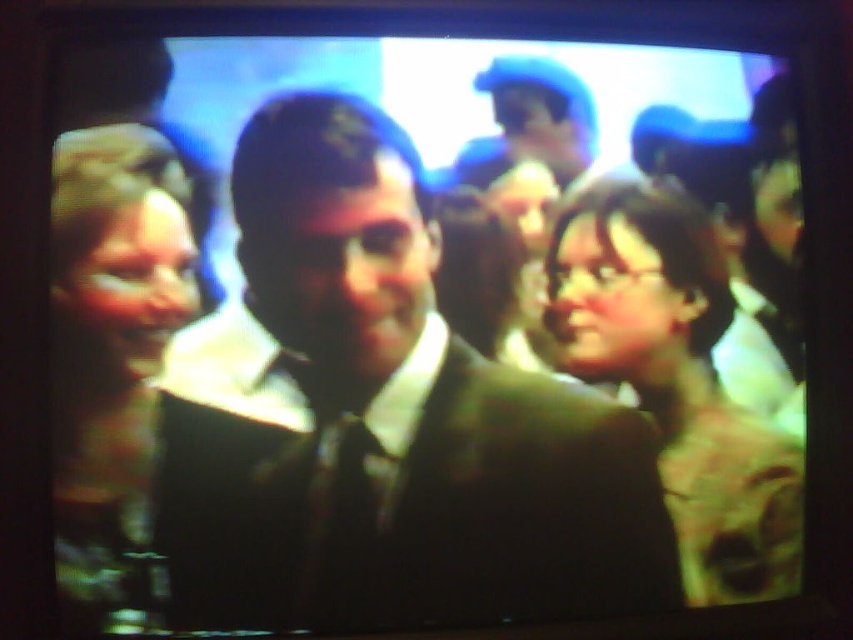
You are a fashion designer observing the television screen and notice two items of clothing. The items are the matte black dress at left and the matte black glasses at center. Which item appears taller on the screen?

The matte black dress at left is taller than the matte black glasses at center on the screen.

You are standing in front of the television screen and want to locate the matte black suit at center. Based on the coordinates provided in the Objects Description, can you determine its position relative to the center of the screen?

The matte black suit at center is located at coordinates point (381, 420), which means it is positioned slightly to the right and above the center of the screen.

You are a photographer trying to capture a clear shot of both the matte black dress at left and the matte black glasses at center. However, you notice that one object is blocking the other. Which object is covering part of the other?

The matte black dress at left is positioned over the matte black glasses at center, so the dress is covering part of the glasses.